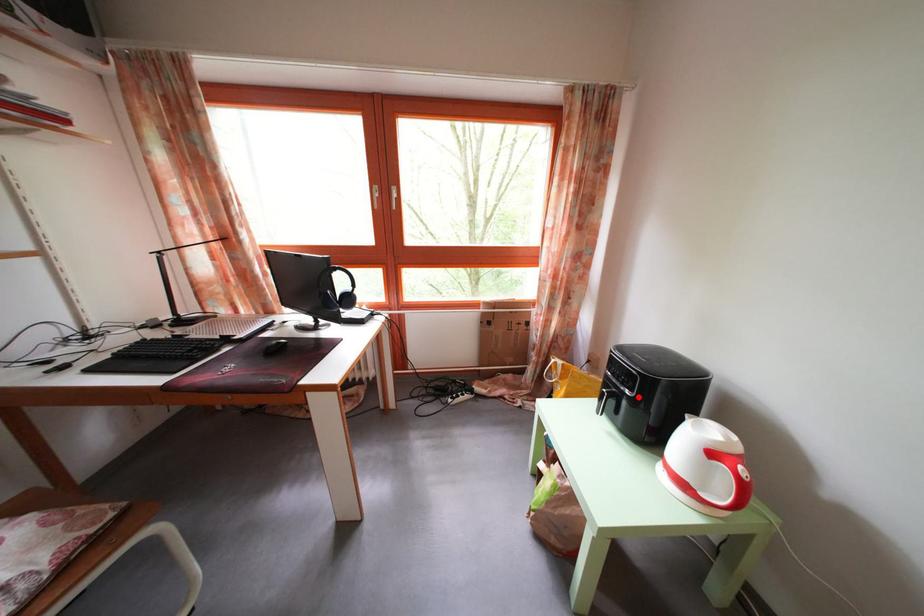
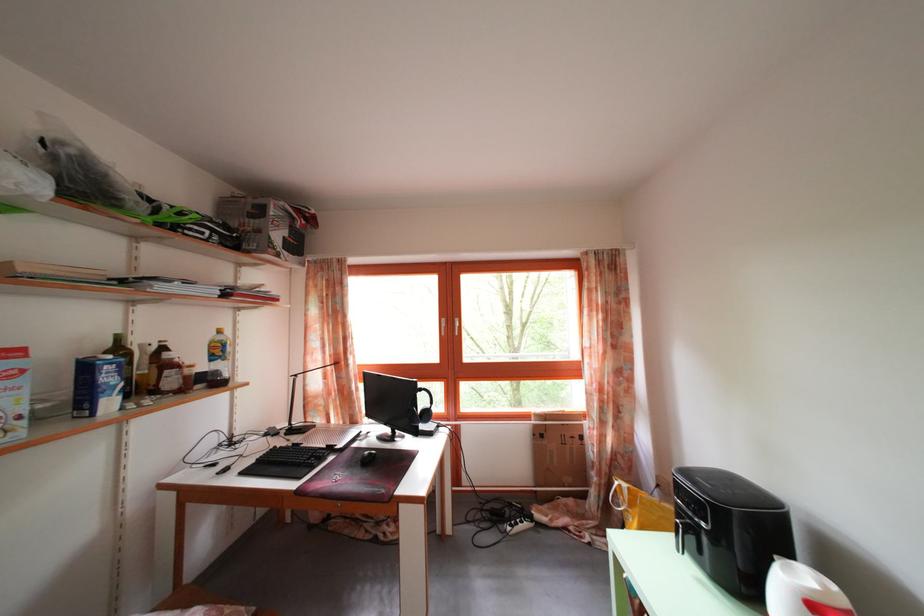
The point at the highlighted location is marked in the first image. Where is the corresponding point in the second image?

(712, 528)